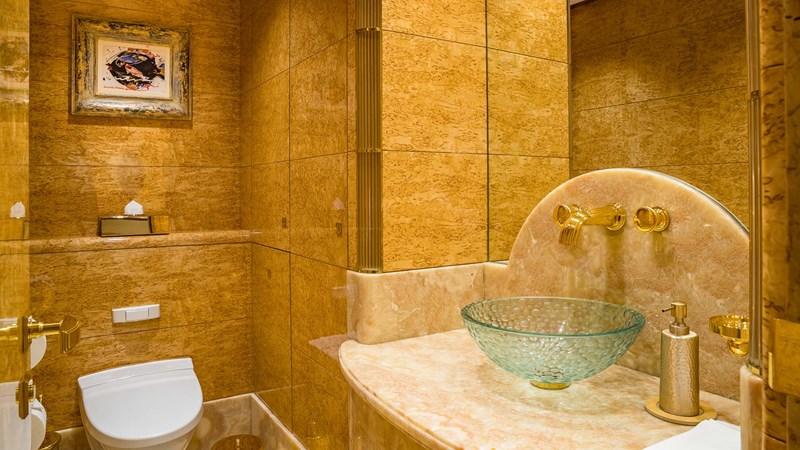
The height and width of the screenshot is (450, 800). What are the coordinates of `door handle` in the screenshot? It's located at (60, 328).